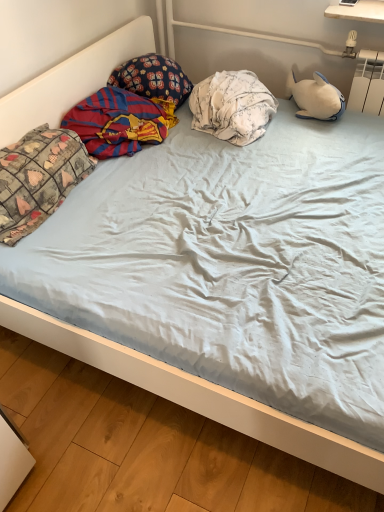
Question: Does white floral fabric pillow at center, placed as the 1th pillow when sorted from right to left, appear on the right side of red and blue striped fabric at left?

Choices:
 (A) no
 (B) yes

Answer: (B)

Question: From the image's perspective, is white floral fabric pillow at center, acting as the 3th pillow starting from the left, under red and blue striped fabric at left?

Choices:
 (A) no
 (B) yes

Answer: (A)

Question: From a real-world perspective, is white floral fabric pillow at center, placed as the 1th pillow when sorted from right to left, physically above red and blue striped fabric at left?

Choices:
 (A) yes
 (B) no

Answer: (A)

Question: Can you confirm if white floral fabric pillow at center, acting as the 3th pillow starting from the left, is shorter than red and blue striped fabric at left?

Choices:
 (A) yes
 (B) no

Answer: (B)

Question: Is white floral fabric pillow at center, acting as the 3th pillow starting from the left, taller than red and blue striped fabric at left?

Choices:
 (A) yes
 (B) no

Answer: (A)

Question: Considering their positions, is red and blue striped fabric at left located in front of or behind dark blue floral pillow at upper left, which ranks as the 2th pillow in right-to-left order?

Choices:
 (A) front
 (B) behind

Answer: (A)

Question: Is point (132, 146) closer or farther from the camera than point (139, 75)?

Choices:
 (A) closer
 (B) farther

Answer: (A)

Question: From a real-world perspective, is red and blue striped fabric at left positioned above or below dark blue floral pillow at upper left, which ranks as the 2th pillow in right-to-left order?

Choices:
 (A) above
 (B) below

Answer: (B)

Question: From the image's perspective, relative to dark blue floral pillow at upper left, placed as the 2th pillow when sorted from left to right, is red and blue striped fabric at left above or below?

Choices:
 (A) above
 (B) below

Answer: (B)

Question: Considering the positions of white floral fabric pillow at center, acting as the 3th pillow starting from the left, and red and blue striped fabric at left in the image, is white floral fabric pillow at center, acting as the 3th pillow starting from the left, wider or thinner than red and blue striped fabric at left?

Choices:
 (A) wide
 (B) thin

Answer: (A)

Question: Which is correct: white floral fabric pillow at center, acting as the 3th pillow starting from the left, is inside red and blue striped fabric at left, or outside of it?

Choices:
 (A) outside
 (B) inside

Answer: (A)

Question: Considering the positions of point (256, 132) and point (155, 131), is point (256, 132) closer or farther from the camera than point (155, 131)?

Choices:
 (A) farther
 (B) closer

Answer: (B)

Question: In the image, is white floral fabric pillow at center, acting as the 3th pillow starting from the left, on the left side or the right side of red and blue striped fabric at left?

Choices:
 (A) right
 (B) left

Answer: (A)

Question: From the image's perspective, is patchwork fabric pillow at left, the first pillow from the left, positioned above or below dark blue floral pillow at upper left, which ranks as the 2th pillow in right-to-left order?

Choices:
 (A) below
 (B) above

Answer: (A)

Question: Considering the positions of point (13, 241) and point (168, 96), is point (13, 241) closer or farther from the camera than point (168, 96)?

Choices:
 (A) farther
 (B) closer

Answer: (B)